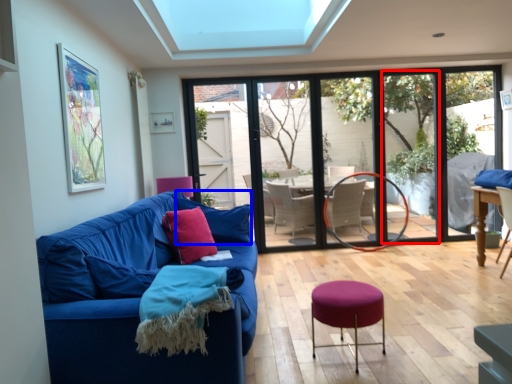
Question: Among these objects, which one is nearest to the camera, window screen (highlighted by a red box) or pillow (highlighted by a blue box)?

Choices:
 (A) window screen
 (B) pillow

Answer: (B)